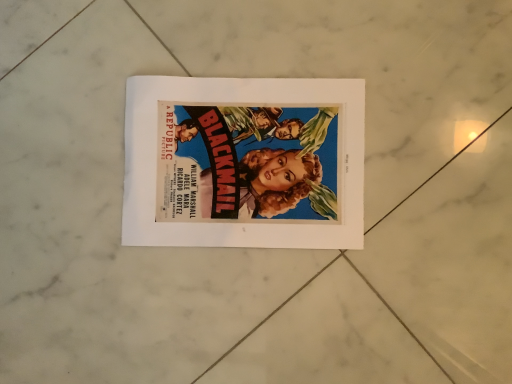
This screenshot has width=512, height=384. What are the coordinates of `free location to the right of matte paper poster at center` in the screenshot? It's located at (418, 121).